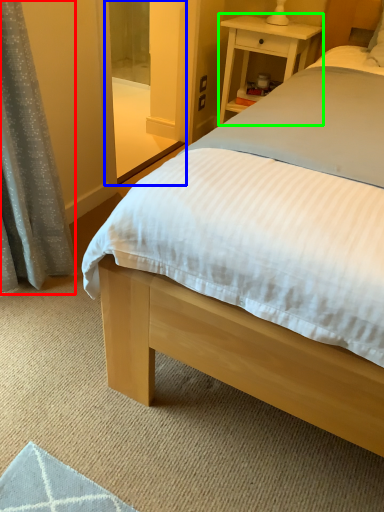
Question: Considering the real-world distances, which object is farthest from curtain (highlighted by a red box)? screen door (highlighted by a blue box) or nightstand (highlighted by a green box)?

Choices:
 (A) screen door
 (B) nightstand

Answer: (B)